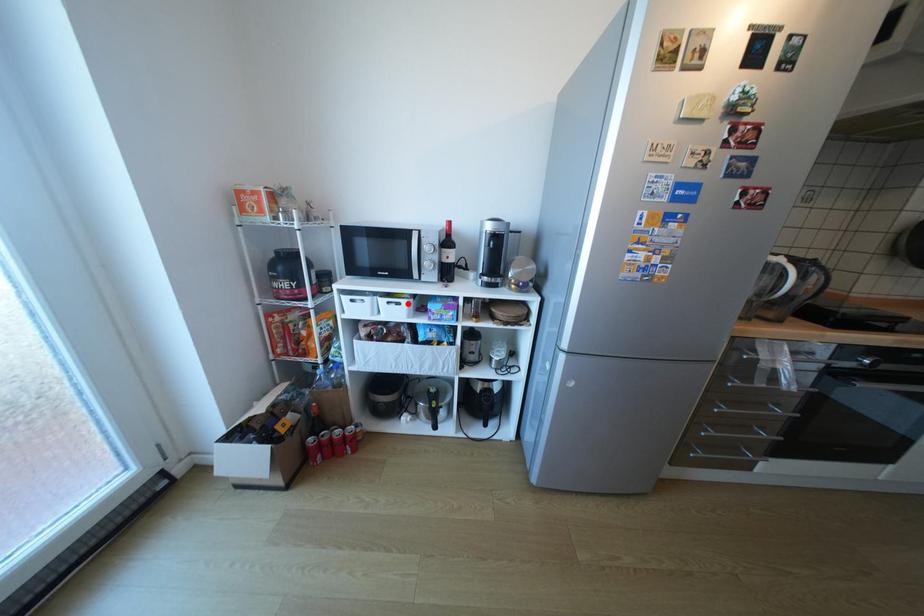
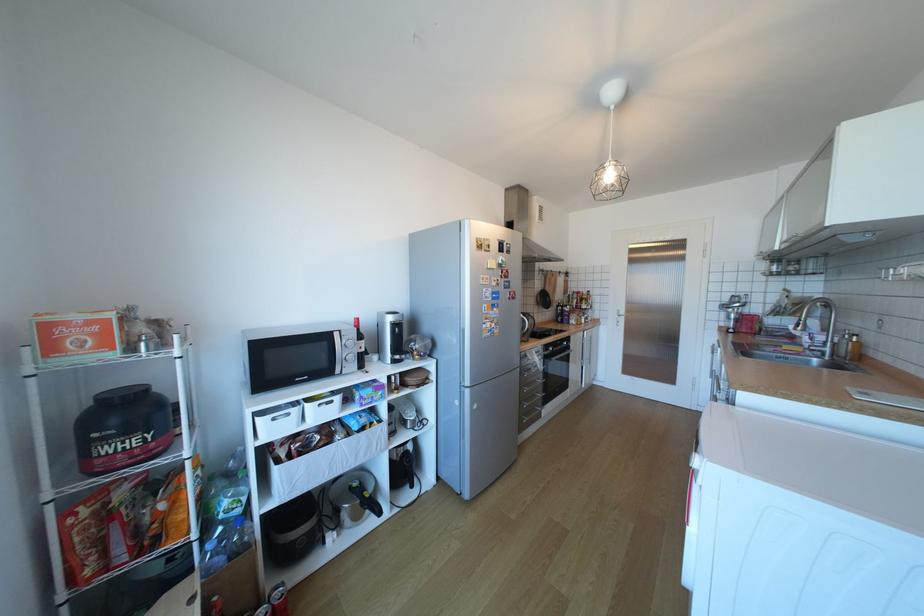
The point at the highlighted location is marked in the first image. Where is the corresponding point in the second image?

(341, 402)